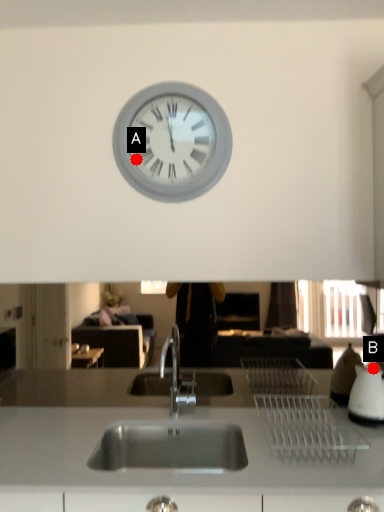
Question: Two points are circled on the image, labeled by A and B beside each circle. Which point appears farthest from the camera in this image?

Choices:
 (A) A is further
 (B) B is further

Answer: (A)